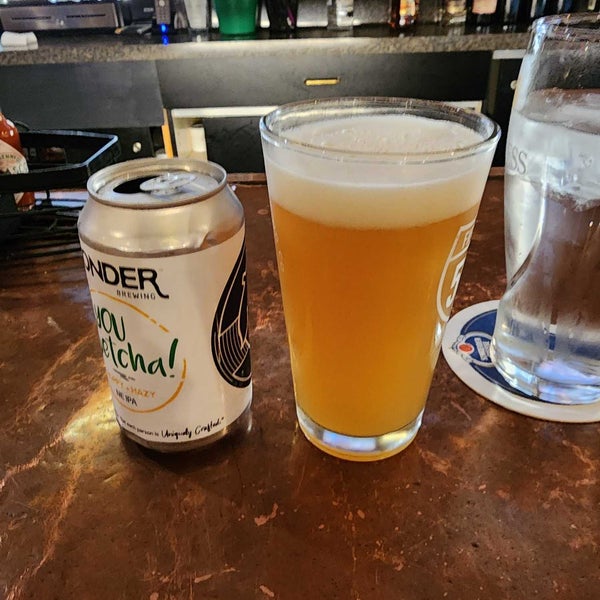
The width and height of the screenshot is (600, 600). Identify the location of counter. (126, 51).